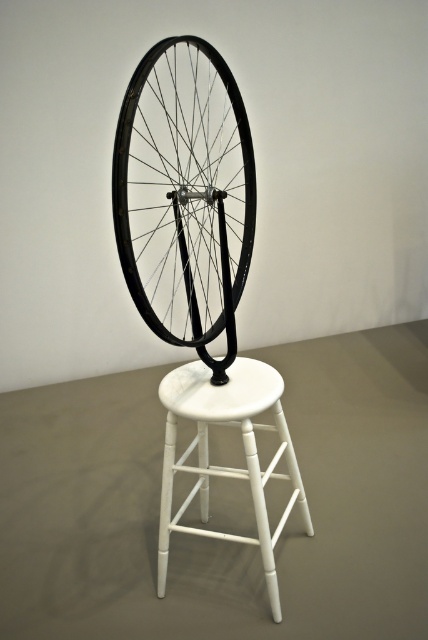
Question: Where is black matte bicycle wheel at center located in relation to white matte bar stool at center in the image?

Choices:
 (A) left
 (B) right

Answer: (A)

Question: Which point appears closest to the camera in this image?

Choices:
 (A) (275, 417)
 (B) (152, 300)

Answer: (A)

Question: Which of the following is the closest to the observer?

Choices:
 (A) (249, 422)
 (B) (228, 86)

Answer: (A)

Question: Which of the following is the closest to the observer?

Choices:
 (A) (231, 394)
 (B) (190, 289)

Answer: (B)

Question: Does black matte bicycle wheel at center lie in front of white matte bar stool at center?

Choices:
 (A) no
 (B) yes

Answer: (B)

Question: Does black matte bicycle wheel at center appear over white matte bar stool at center?

Choices:
 (A) yes
 (B) no

Answer: (A)